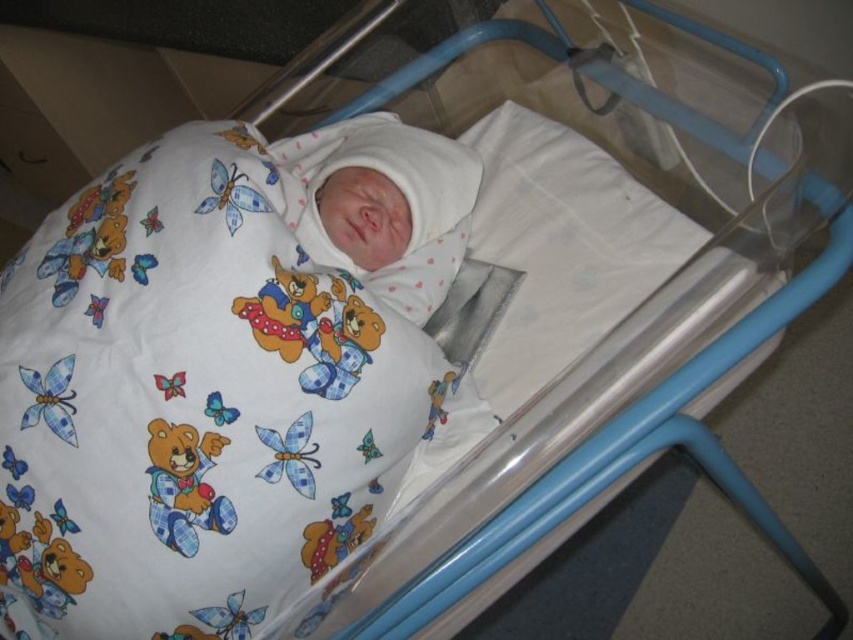
Question: Can you confirm if white fabric with teddy bear print at center is positioned to the right of white cotton swaddle at center?

Choices:
 (A) yes
 (B) no

Answer: (B)

Question: Does white fabric with teddy bear print at center have a larger size compared to white cotton swaddle at center?

Choices:
 (A) no
 (B) yes

Answer: (B)

Question: Considering the relative positions of white fabric with teddy bear print at center and white cotton swaddle at center in the image provided, where is white fabric with teddy bear print at center located with respect to white cotton swaddle at center?

Choices:
 (A) above
 (B) below

Answer: (B)

Question: Among these objects, which one is nearest to the camera?

Choices:
 (A) white fabric with teddy bear print at center
 (B) white cotton swaddle at center

Answer: (A)